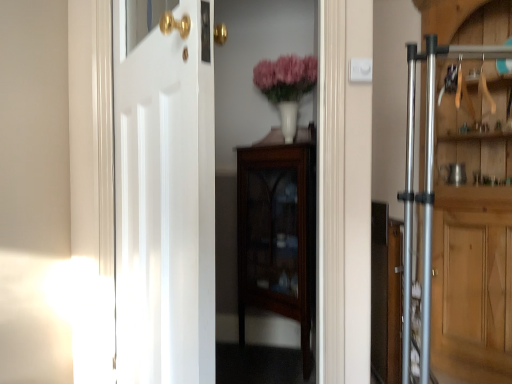
Question: In the image, is mahogany glass-front cabinet at center positioned in front of or behind pink matte vase at upper center?

Choices:
 (A) behind
 (B) front

Answer: (B)

Question: From the image's perspective, is mahogany glass-front cabinet at center located above or below pink matte vase at upper center?

Choices:
 (A) below
 (B) above

Answer: (A)

Question: Which is nearer to the white glossy door at center, which ranks as the first door in left-to-right order?

Choices:
 (A) mahogany glass-front cabinet at center
 (B) silver metallic door at right, the 1th door viewed from the right
 (C) pink matte vase at upper center

Answer: (A)

Question: Based on their relative distances, which object is nearer to the mahogany glass-front cabinet at center?

Choices:
 (A) pink matte vase at upper center
 (B) silver metallic door at right, the second door viewed from the left
 (C) white glossy door at center, which ranks as the first door in left-to-right order

Answer: (A)